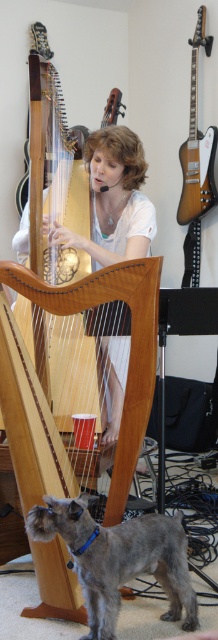
Consider the image. Can you confirm if gray fur dog at lower left is wider than satin-finished electric guitar at upper right?

Indeed, gray fur dog at lower left has a greater width compared to satin-finished electric guitar at upper right.

Is point (139, 520) less distant than point (199, 173)?

Yes, point (139, 520) is in front of point (199, 173).

Is point (180, 570) positioned before point (211, 161)?

Yes, it is in front of point (211, 161).

You are a GUI agent. You are given a task and a screenshot of the screen. Output one action in this format:
    pyautogui.click(x=<x>, y=<y>)
    Task: Click on the gray fur dog at lower left
    
    Given the screenshot: What is the action you would take?
    pyautogui.click(x=117, y=557)